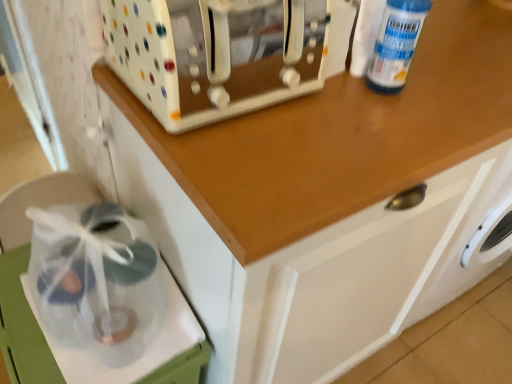
Locate an element on the screen. This screenshot has width=512, height=384. empty space that is to the right of clear plastic bottle at upper right is located at coordinates (451, 94).